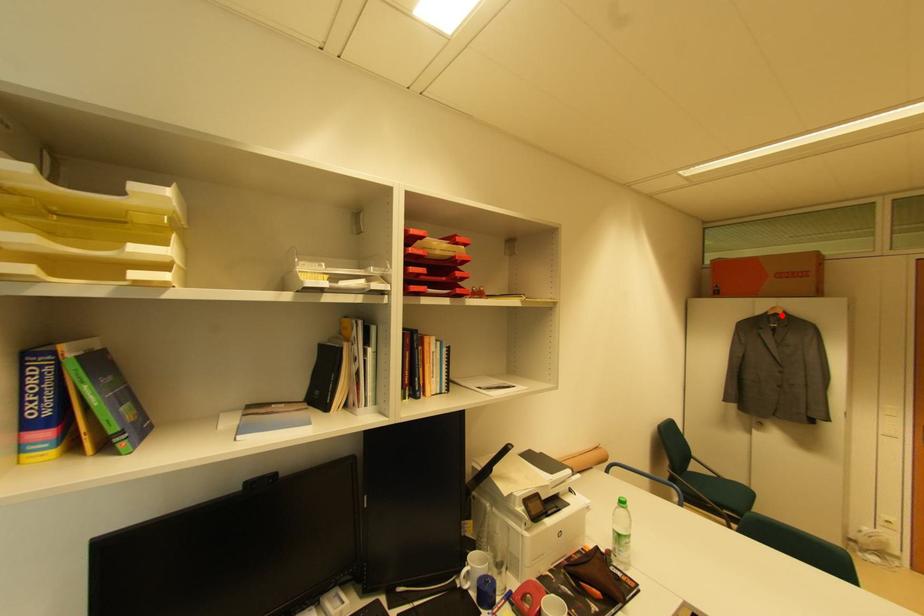
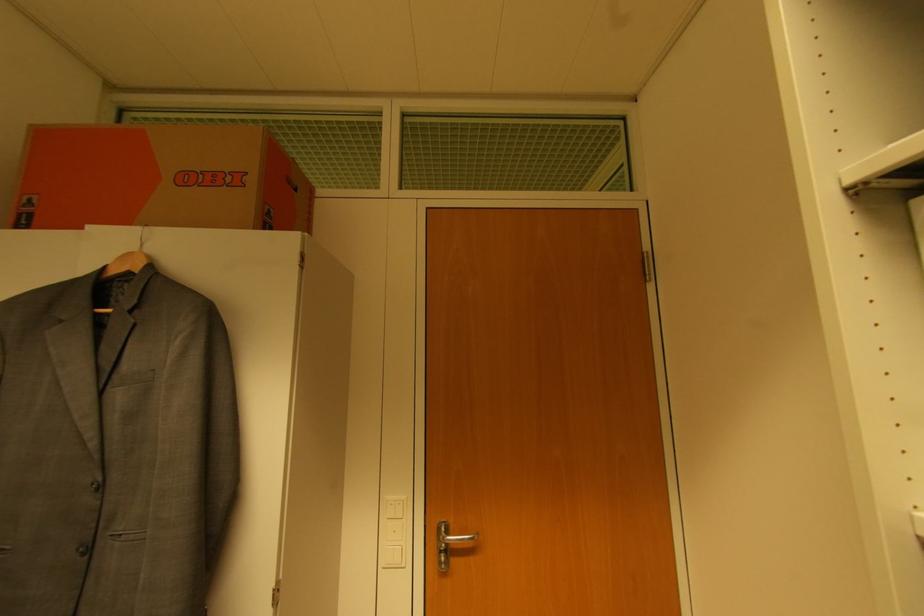
Question: I am providing you with two images of the same scene from different viewpoints. A red point is marked on the first image. At the location where the point appears in image 1, is it still visible in image 2?

Choices:
 (A) Yes
 (B) No

Answer: (A)